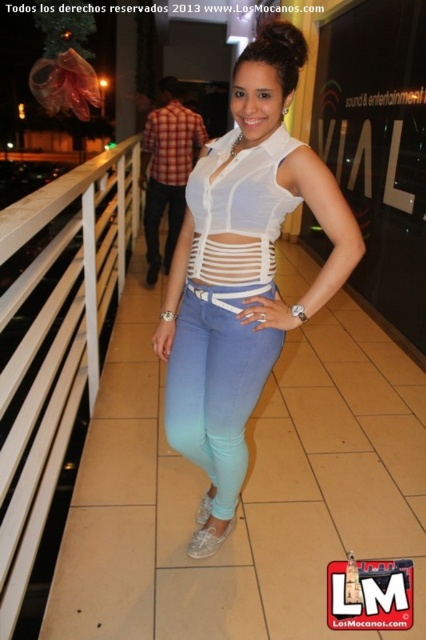
Question: Can you confirm if light blue denim jeans at center is positioned above white sheer top at center?

Choices:
 (A) yes
 (B) no

Answer: (B)

Question: Does white matte top at center come behind light blue denim jeans at center?

Choices:
 (A) yes
 (B) no

Answer: (B)

Question: Does light blue denim jeans at center appear over white sheer top at center?

Choices:
 (A) yes
 (B) no

Answer: (B)

Question: Which point is closer to the camera taking this photo?

Choices:
 (A) (175, 358)
 (B) (216, 467)
 (C) (42, 337)

Answer: (C)

Question: Which object is positioned farthest from the white matte top at center?

Choices:
 (A) white wood rail at left
 (B) light blue denim jeans at center

Answer: (A)

Question: Which object is farther from the camera taking this photo?

Choices:
 (A) white sheer top at center
 (B) light blue denim jeans at center
 (C) white matte top at center

Answer: (A)